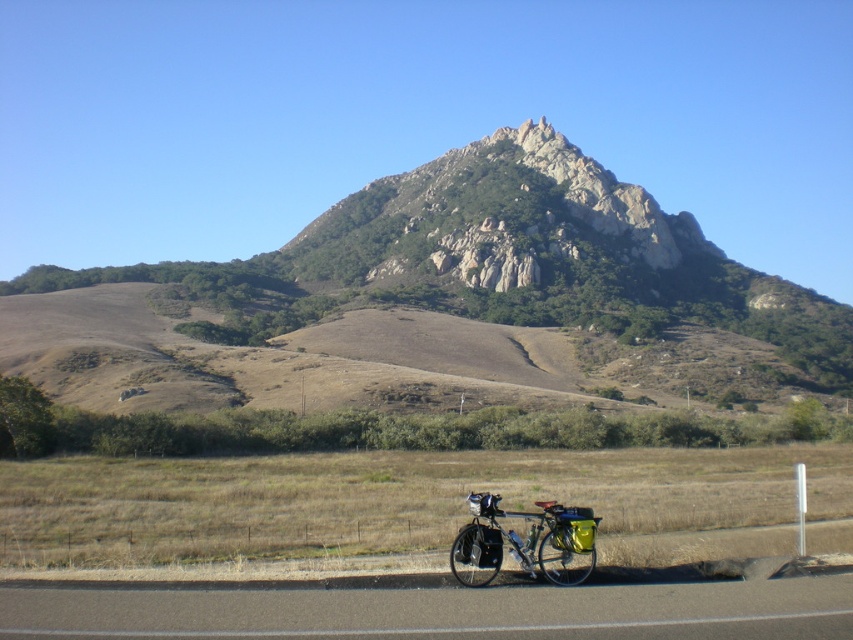
From the picture: You are a hiker planning to cross the rocky at center in the image. Given that the coordinates of the rocky area are at point 0.409, 0.583, can you estimate its position relative to the center of the image?

The rocky at center is located at coordinates (496,260), which places it slightly to the right and above the exact center of the image.